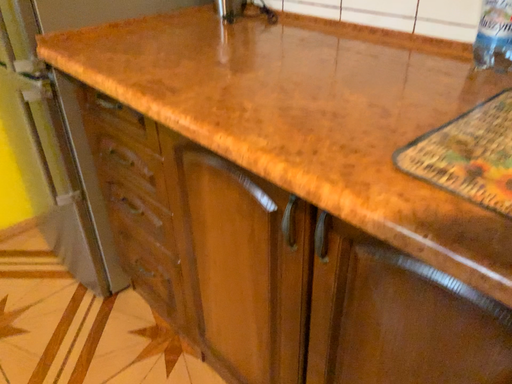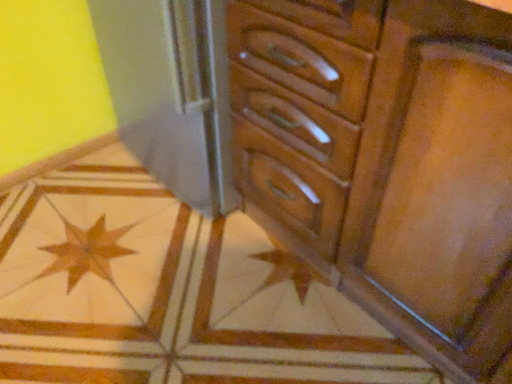
Question: How did the camera likely rotate when shooting the video?

Choices:
 (A) rotated upward
 (B) rotated downward

Answer: (B)